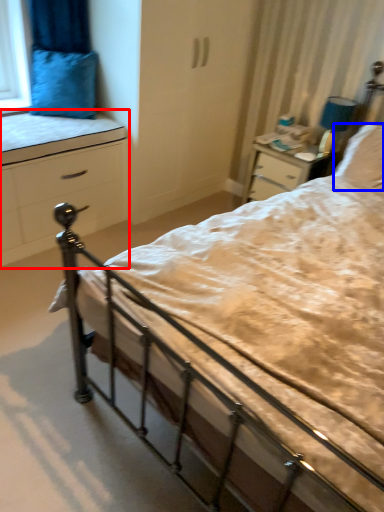
Question: Which object is closer to the camera taking this photo, chest of drawers (highlighted by a red box) or pillow (highlighted by a blue box)?

Choices:
 (A) chest of drawers
 (B) pillow

Answer: (A)